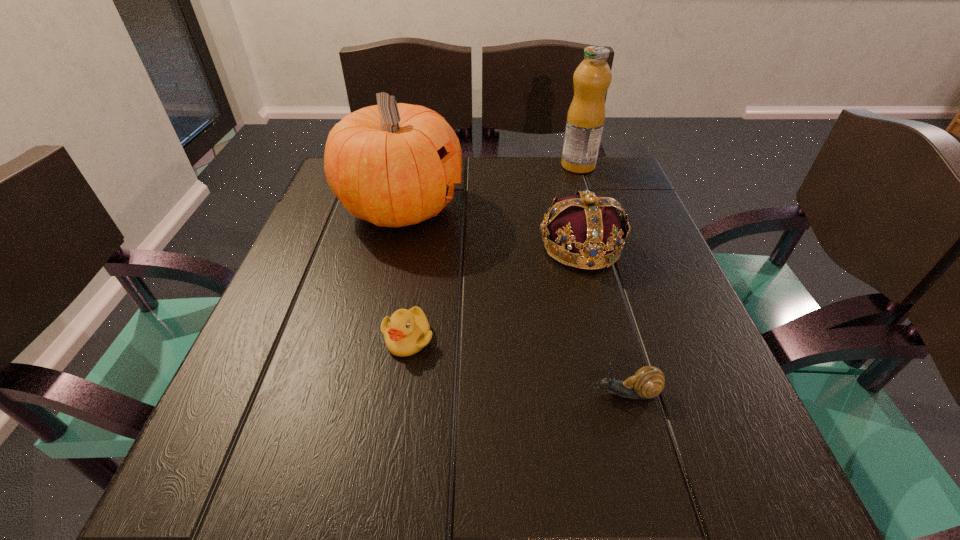
Identify the location of fruit juice. This screenshot has height=540, width=960. (585, 120).

Identify the location of pumpkin. The height and width of the screenshot is (540, 960). (393, 164).

I want to click on crown, so click(590, 227).

At what (x,y) coordinates should I click in order to perform the action: click on duckling. Please return your answer as a coordinate pair (x, y). This screenshot has height=540, width=960. Looking at the image, I should click on (406, 332).

Find the location of `the fourth tallest object`. the fourth tallest object is located at coordinates (406, 332).

Where is `the nearest object`? the nearest object is located at coordinates (647, 382).

Image resolution: width=960 pixels, height=540 pixels. I want to click on the shortest object, so click(x=647, y=382).

I want to click on free location located on the front label of the fruit juice, so click(500, 166).

Where is `vacant area situated 0.070m on the front label of the fruit juice`? This screenshot has height=540, width=960. vacant area situated 0.070m on the front label of the fruit juice is located at coordinates (534, 166).

Image resolution: width=960 pixels, height=540 pixels. I want to click on vacant space positioned on the front label of the fruit juice, so click(541, 166).